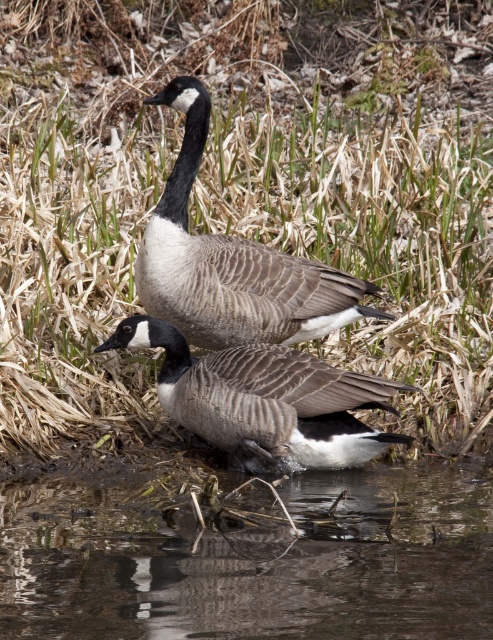
Which is behind, point (444, 513) or point (276, 449)?

Point (276, 449)

Is point (255, 532) in front of point (364, 401)?

Yes, it is.

You are a GUI agent. You are given a task and a screenshot of the screen. Output one action in this format:
    pyautogui.click(x=<x>, y=<y>)
    Task: Click on the brown murky water at lower center
    This screenshot has width=493, height=640.
    Given the screenshot: What is the action you would take?
    pyautogui.click(x=248, y=556)

Can you confirm if gray matte goose at center is positioned to the right of brown textured duck at center?

In fact, gray matte goose at center is to the left of brown textured duck at center.

Who is lower down, gray matte goose at center or brown textured duck at center?

brown textured duck at center is lower down.

Does point (183, 134) come closer to viewer compared to point (169, 387)?

That is False.

This screenshot has width=493, height=640. I want to click on gray matte goose at center, so click(232, 262).

Who is shorter, brown murky water at lower center or gray matte goose at center?

Standing shorter between the two is brown murky water at lower center.

Can you confirm if brown murky water at lower center is wider than gray matte goose at center?

Correct, the width of brown murky water at lower center exceeds that of gray matte goose at center.

Who is more forward, (122, 540) or (287, 296)?

Point (122, 540)

The height and width of the screenshot is (640, 493). In order to click on brown murky water at lower center in this screenshot , I will do `click(248, 556)`.